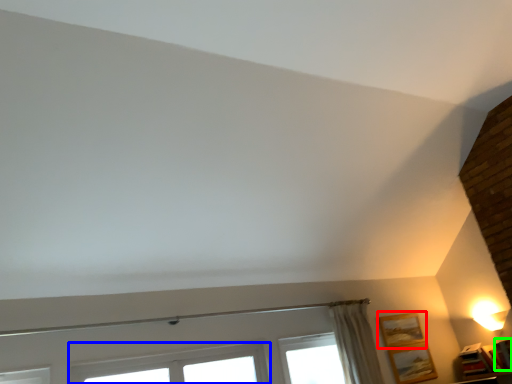
Question: Which object is the farthest from picture frame (highlighted by a red box)? Choose among these: window (highlighted by a blue box) or picture frame (highlighted by a green box).

Choices:
 (A) window
 (B) picture frame

Answer: (A)